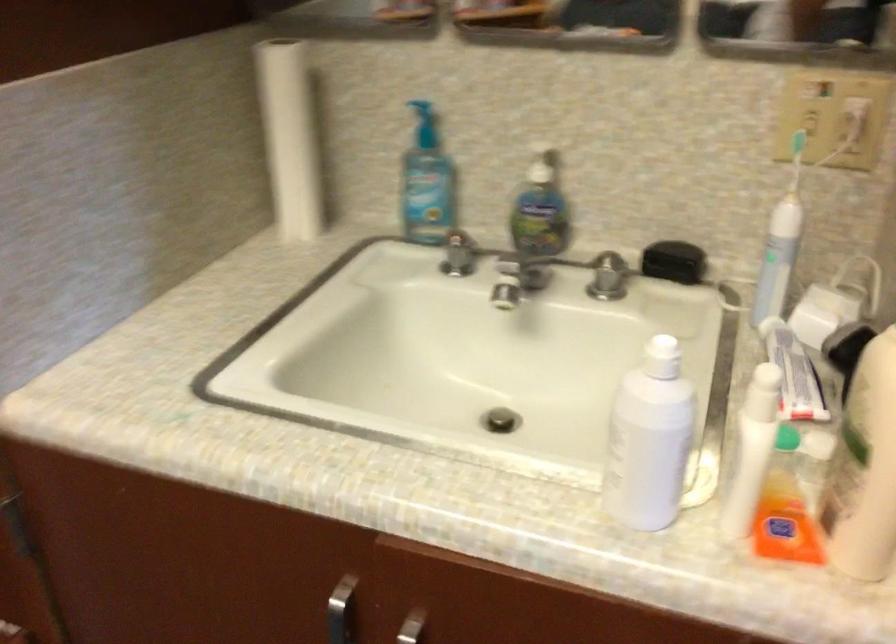
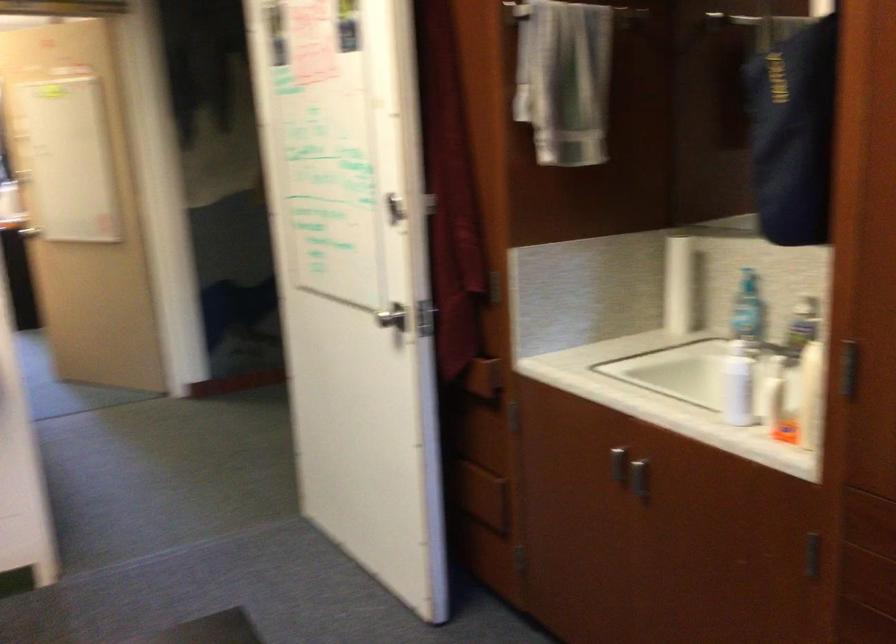
Question: I am providing you with two images of the same scene from different viewpoints. Which of the following objects are not visible in image2?

Choices:
 (A) silver faucet handle
 (B) silver door handle
 (C) silver cabinet handle
 (D) purple plastic object

Answer: (A)